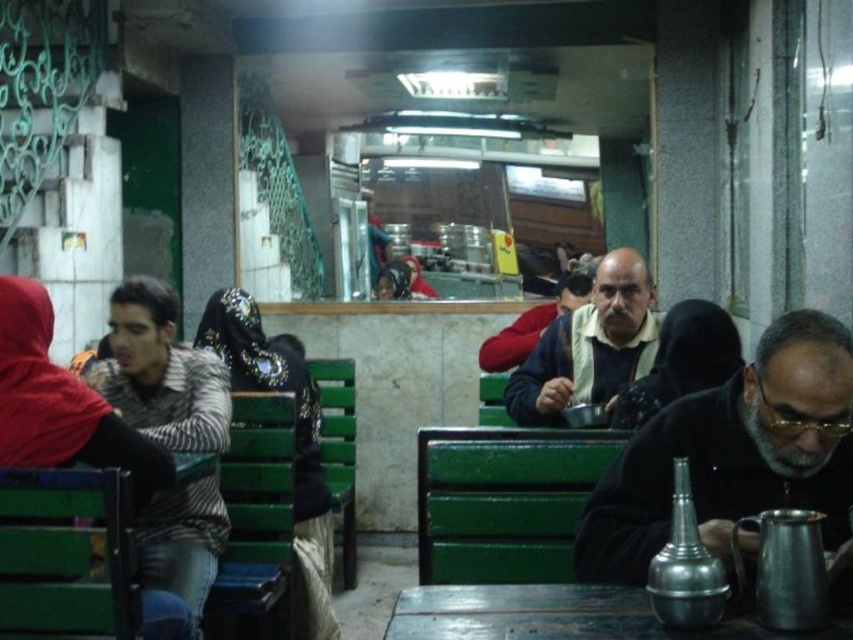
Does striped fabric shirt at left have a smaller size compared to metallic wooden table at center?

No, striped fabric shirt at left is not smaller than metallic wooden table at center.

Describe the element at coordinates (161, 372) in the screenshot. I see `striped fabric shirt at left` at that location.

I want to click on striped fabric shirt at left, so click(x=161, y=372).

Looking at this image, is striped fabric shirt at left thinner than dark blue sweater at center?

No, striped fabric shirt at left is not thinner than dark blue sweater at center.

Is point (115, 385) farther from camera compared to point (535, 340)?

No.

At what (x,y) coordinates should I click in order to perform the action: click on striped fabric shirt at left. Please return your answer as a coordinate pair (x, y). The height and width of the screenshot is (640, 853). Looking at the image, I should click on (161, 372).

Who is positioned more to the right, metallic silver teapot at right or dark blue shirt at center?

metallic silver teapot at right is more to the right.

Which is in front, point (779, 413) or point (523, 404)?

Point (779, 413)

This screenshot has height=640, width=853. I want to click on metallic silver teapot at right, so click(733, 452).